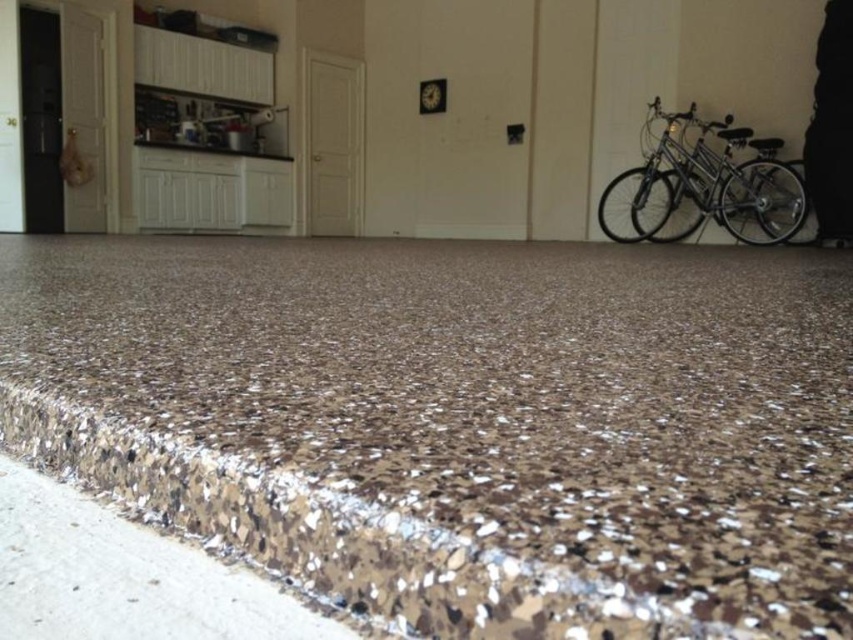
Is brown speckled concrete at lower left taller than silver metallic bicycle at right?

In fact, brown speckled concrete at lower left may be shorter than silver metallic bicycle at right.

Between brown speckled concrete at lower left and silver metallic bicycle at right, which one appears on the right side from the viewer's perspective?

silver metallic bicycle at right is more to the right.

Find the location of a particular element. The height and width of the screenshot is (640, 853). brown speckled concrete at lower left is located at coordinates (125, 577).

Where is `brown speckled concrete at lower left`? brown speckled concrete at lower left is located at coordinates (125, 577).

Can you confirm if brown speckled concrete at lower left is smaller than brown speckled granite counter top at upper left?

Indeed, brown speckled concrete at lower left has a smaller size compared to brown speckled granite counter top at upper left.

Does brown speckled concrete at lower left appear on the right side of brown speckled granite counter top at upper left?

Indeed, brown speckled concrete at lower left is positioned on the right side of brown speckled granite counter top at upper left.

At what (x,y) coordinates should I click in order to perform the action: click on brown speckled concrete at lower left. Please return your answer as a coordinate pair (x, y). This screenshot has height=640, width=853. Looking at the image, I should click on (125, 577).

Does shiny metallic granite at center have a greater height compared to brown speckled granite counter top at upper left?

Indeed, shiny metallic granite at center has a greater height compared to brown speckled granite counter top at upper left.

Can you confirm if shiny metallic granite at center is wider than brown speckled granite counter top at upper left?

Yes.

Which is behind, point (271, 516) or point (236, 152)?

The point (236, 152) is more distant.

Find the location of a particular element. shiny metallic granite at center is located at coordinates (462, 420).